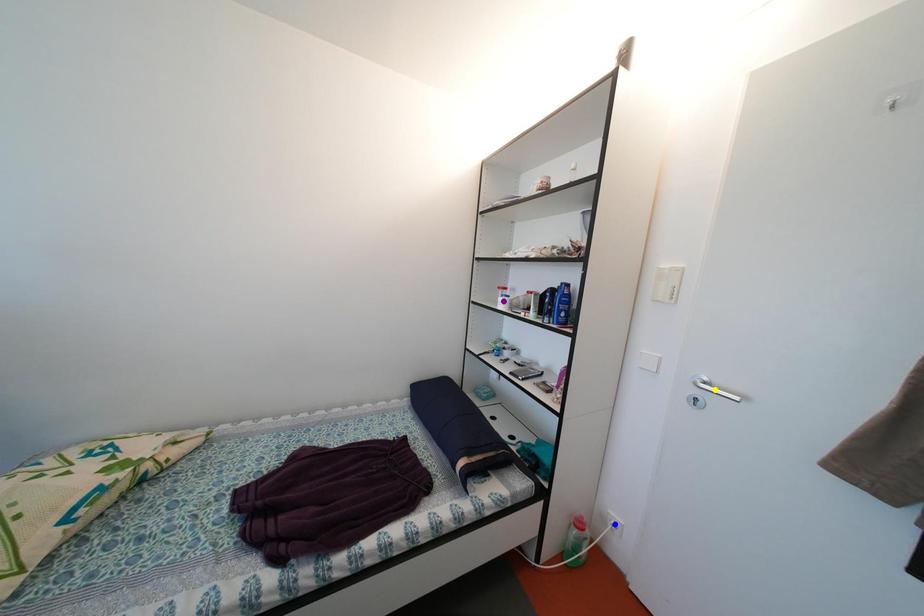
Order these from nearest to farthest:
A) yellow point
B) blue point
C) purple point

yellow point → blue point → purple point